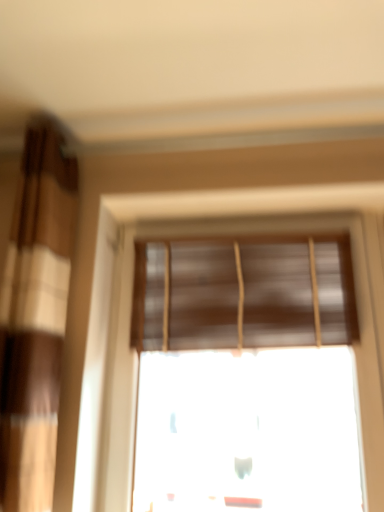
The height and width of the screenshot is (512, 384). What do you see at coordinates (35, 318) in the screenshot? I see `brown textured curtain at left` at bounding box center [35, 318].

Locate an element on the screen. The height and width of the screenshot is (512, 384). brown matte window blind at upper center is located at coordinates (243, 294).

What do you see at coordinates (243, 294) in the screenshot?
I see `brown matte window blind at upper center` at bounding box center [243, 294].

In the scene shown: Measure the distance between point [199,439] and camera.

The distance of point [199,439] from camera is 1.51 meters.

The height and width of the screenshot is (512, 384). Identify the location of brown textured curtain at left. (35, 318).

From the image's perspective, does brown matte blinds at center appear higher than brown matte window blind at upper center?

Actually, brown matte blinds at center appears below brown matte window blind at upper center in the image.

Consider the image. Which of these two, brown matte blinds at center or brown matte window blind at upper center, stands shorter?

Standing shorter between the two is brown matte window blind at upper center.

Is brown matte blinds at center positioned before brown matte window blind at upper center?

Yes, brown matte blinds at center is closer to the viewer.

From the picture: Which object is positioned more to the right, brown matte blinds at center or brown matte window blind at upper center?

Positioned to the right is brown matte window blind at upper center.

Considering the positions of objects brown textured curtain at left and brown matte blinds at center in the image provided, who is in front, brown textured curtain at left or brown matte blinds at center?

brown textured curtain at left is more forward.

From the picture: From a real-world perspective, between brown textured curtain at left and brown matte blinds at center, who is vertically higher?

brown textured curtain at left.

Considering the sizes of brown textured curtain at left and brown matte blinds at center in the image, is brown textured curtain at left wider or thinner than brown matte blinds at center?

Clearly, brown textured curtain at left has more width compared to brown matte blinds at center.

Where is `curtain above the brown matte blinds at center (from the image's perspective)`? Image resolution: width=384 pixels, height=512 pixels. curtain above the brown matte blinds at center (from the image's perspective) is located at coordinates (35, 318).

Is brown matte blinds at center located outside brown textured curtain at left?

Absolutely, brown matte blinds at center is external to brown textured curtain at left.

Which object is more forward, brown matte blinds at center or brown textured curtain at left?

brown textured curtain at left is in front.

At what (x,y) coordinates should I click in order to perform the action: click on window below the brown textured curtain at left (from a real-world perspective). Please return your answer as a coordinate pair (x, y). This screenshot has width=384, height=512. Looking at the image, I should click on (185, 425).

Considering the sizes of objects brown matte window blind at upper center and brown textured curtain at left in the image provided, who is taller, brown matte window blind at upper center or brown textured curtain at left?

brown textured curtain at left.

How much distance is there between brown matte window blind at upper center and brown textured curtain at left?

brown matte window blind at upper center and brown textured curtain at left are 19.14 inches apart from each other.

Is brown matte window blind at upper center far away from brown textured curtain at left?

No, there isn't a large distance between brown matte window blind at upper center and brown textured curtain at left.

At what (x,y) coordinates should I click in order to perform the action: click on curtain that appears in front of the brown matte window blind at upper center. Please return your answer as a coordinate pair (x, y). The image size is (384, 512). Looking at the image, I should click on (35, 318).

Does point (262, 246) appear closer or farther from the camera than point (215, 474)?

Clearly, point (262, 246) is closer to the camera than point (215, 474).

How much distance is there between brown matte window blind at upper center and brown matte blinds at center?

brown matte window blind at upper center is 10.02 inches away from brown matte blinds at center.

Where is `window below the brown matte window blind at upper center (from the image's perspective)`? Image resolution: width=384 pixels, height=512 pixels. window below the brown matte window blind at upper center (from the image's perspective) is located at coordinates (185, 425).

Is brown matte blinds at center surrounded by brown matte window blind at upper center?

Actually, brown matte blinds at center is outside brown matte window blind at upper center.

Is brown textured curtain at left looking in the opposite direction of brown matte window blind at upper center?

brown textured curtain at left is not turned away from brown matte window blind at upper center.

How different are the orientations of brown textured curtain at left and brown matte window blind at upper center in degrees?

The facing directions of brown textured curtain at left and brown matte window blind at upper center are 0.437 degrees apart.

From the image's perspective, relative to brown matte window blind at upper center, is brown textured curtain at left above or below?

brown textured curtain at left is above brown matte window blind at upper center.

Can you confirm if brown textured curtain at left is wider than brown matte window blind at upper center?

Correct, the width of brown textured curtain at left exceeds that of brown matte window blind at upper center.

The height and width of the screenshot is (512, 384). In order to click on window below the brown matte window blind at upper center (from the image's perspective) in this screenshot , I will do `click(185, 425)`.

Locate an element on the screen. This screenshot has height=512, width=384. window below the brown textured curtain at left (from a real-world perspective) is located at coordinates click(x=185, y=425).

Based on their spatial positions, is brown matte window blind at upper center or brown textured curtain at left further from brown matte blinds at center?

Among the two, brown textured curtain at left is located further to brown matte blinds at center.

Based on their spatial positions, is brown matte blinds at center or brown matte window blind at upper center closer to brown textured curtain at left?

brown matte window blind at upper center is positioned closer to the anchor brown textured curtain at left.

Looking at the image, which one is located further to brown matte window blind at upper center, brown matte blinds at center or brown textured curtain at left?

brown textured curtain at left.

From the image, which object appears to be nearer to brown matte blinds at center, brown textured curtain at left or brown matte window blind at upper center?

Based on the image, brown matte window blind at upper center appears to be nearer to brown matte blinds at center.

Looking at the image, which one is located further to brown matte window blind at upper center, brown textured curtain at left or brown matte blinds at center?

brown textured curtain at left is positioned further to the anchor brown matte window blind at upper center.

Considering their positions, is brown matte window blind at upper center positioned further to brown textured curtain at left than brown matte blinds at center?

The object further to brown textured curtain at left is brown matte blinds at center.

Locate an element on the screen. window between brown textured curtain at left and brown matte window blind at upper center from left to right is located at coordinates (185, 425).